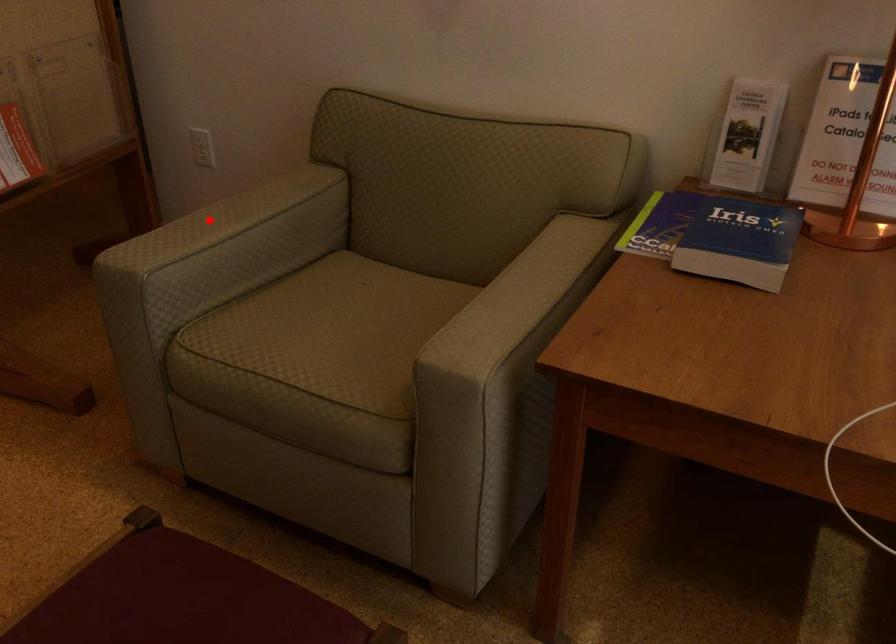
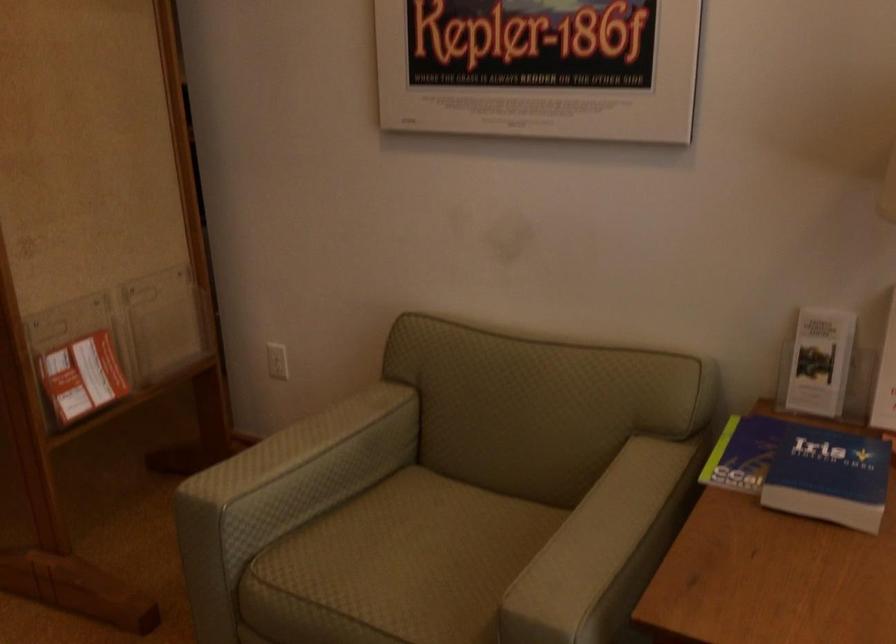
The point at the highlighted location is marked in the first image. Where is the corresponding point in the second image?

(286, 449)